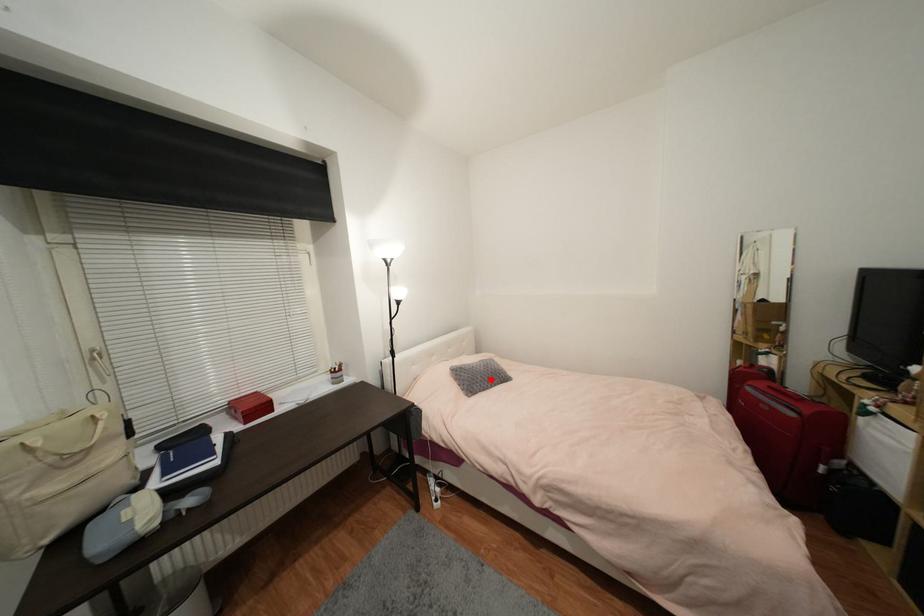
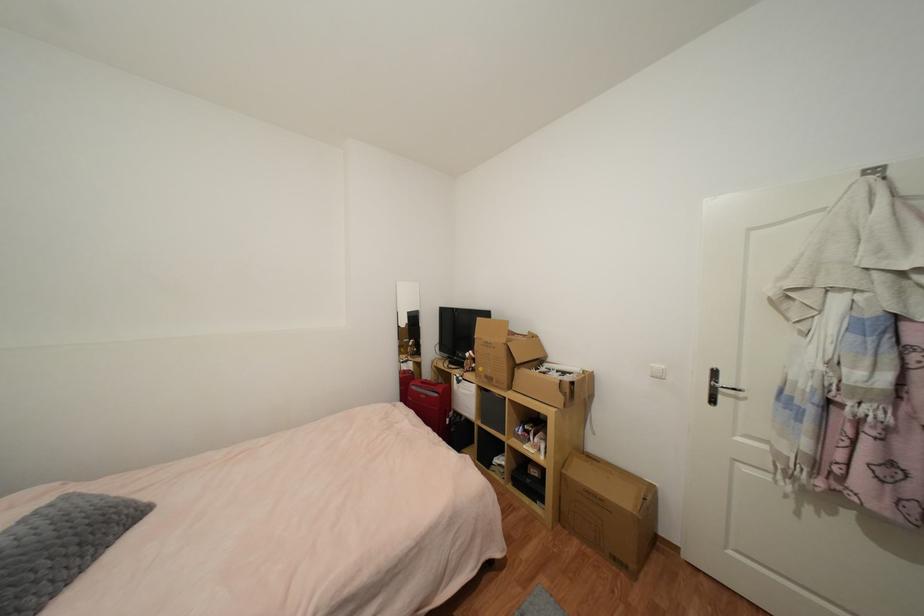
Question: I am providing you with two images of the same scene from different viewpoints. In image1, a red point is highlighted. Considering the same 3D point in image2, which of the following is correct?

Choices:
 (A) It is closer
 (B) It is farther

Answer: (A)